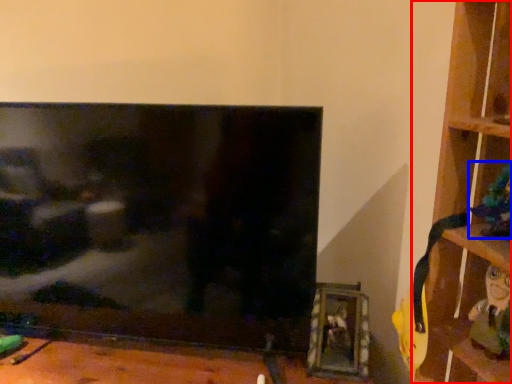
Question: Which of the following is the farthest to the observer, shelf (highlighted by a red box) or toy (highlighted by a blue box)?

Choices:
 (A) shelf
 (B) toy

Answer: (B)